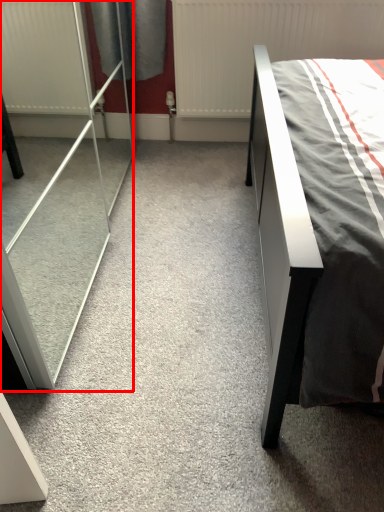
Question: In this image, where is screen door (annotated by the red box) located relative to radiator?

Choices:
 (A) right
 (B) left

Answer: (B)